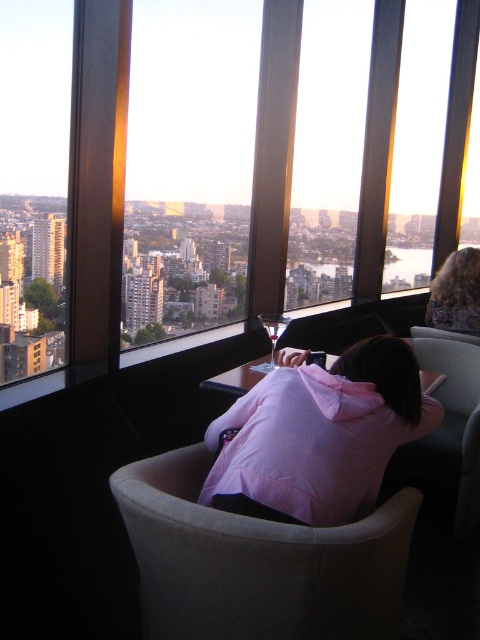
You are standing in the high rise restaurant and want to take a photo of the sunset through the transparent glass window at left. Where exactly should you position yourself to ensure the window is centered in your camera viewfinder?

The transparent glass window at left is located at coordinates point (34, 193), so you should position yourself directly in front of those coordinates to center it in your camera viewfinder.